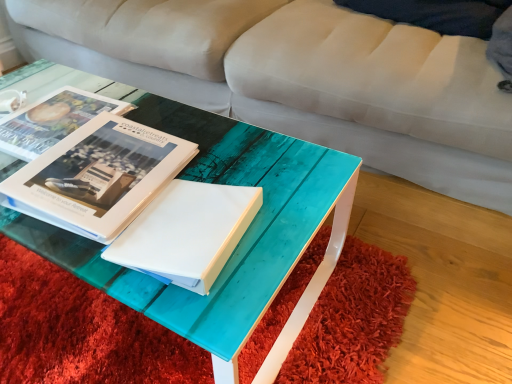
In order to face translucent teal table at center, should I rotate leftwards or rightwards?

It's best to rotate left around 11.096 degrees.

This screenshot has height=384, width=512. What do you see at coordinates (187, 233) in the screenshot?
I see `white matte paper at center` at bounding box center [187, 233].

Describe the element at coordinates (52, 120) in the screenshot. I see `matte white book at center, which appears as the 2th book when viewed from the front` at that location.

You are a GUI agent. You are given a task and a screenshot of the screen. Output one action in this format:
    pyautogui.click(x=<x>, y=<y>)
    Task: Click on the translucent teal table at center
    The height and width of the screenshot is (384, 512).
    Given the screenshot: What is the action you would take?
    pyautogui.click(x=81, y=331)

Can you confirm if white matte paper at center is positioned to the right of teal glossy wood coffee table at center?

Indeed, white matte paper at center is positioned on the right side of teal glossy wood coffee table at center.

Find the location of a particular element. This screenshot has height=384, width=512. coffee table on the left of white matte paper at center is located at coordinates (240, 240).

Who is bigger, white matte paper at center or teal glossy wood coffee table at center?

teal glossy wood coffee table at center is bigger.

Is white matte paper at center positioned beyond the bounds of teal glossy wood coffee table at center?

Yes, white matte paper at center is outside of teal glossy wood coffee table at center.

You are a GUI agent. You are given a task and a screenshot of the screen. Output one action in this format:
    pyautogui.click(x=<x>, y=<y>)
    Task: Click on the mat in front of the white matte paper at center
    
    Given the screenshot: What is the action you would take?
    pyautogui.click(x=81, y=331)

Can you confirm if translucent teal table at center is thinner than white matte paper at center?

Incorrect, the width of translucent teal table at center is not less than that of white matte paper at center.

How different are the orientations of translucent teal table at center and white matte paper at center in degrees?

They differ by 9.74 degrees in their facing directions.

How far apart are matte white book at center, which appears as the 2th book when viewed from the front, and white matte paper at center?

They are 15.70 inches apart.

Which is nearer, (50, 139) or (190, 244)?

Point (50, 139).

Can you confirm if matte white book at center, which appears as the 2th book when viewed from the front, is smaller than white matte paper at center?

Correct, matte white book at center, which appears as the 2th book when viewed from the front, occupies less space than white matte paper at center.

Looking at this image, considering the relative sizes of matte white book at center, marked as the first book in a front-to-back arrangement, and white matte paper at center in the image provided, is matte white book at center, marked as the first book in a front-to-back arrangement, smaller than white matte paper at center?

No, matte white book at center, marked as the first book in a front-to-back arrangement, is not smaller than white matte paper at center.

Is matte white book at center, marked as the first book in a front-to-back arrangement, inside the boundaries of white matte paper at center, or outside?

matte white book at center, marked as the first book in a front-to-back arrangement, exists outside the volume of white matte paper at center.

Does matte white book at center, marked as the first book in a front-to-back arrangement, come behind white matte paper at center?

Yes, matte white book at center, marked as the first book in a front-to-back arrangement, is behind white matte paper at center.

Is the surface of matte white book at center, marked as the first book in a front-to-back arrangement, in direct contact with white matte paper at center?

No, matte white book at center, marked as the first book in a front-to-back arrangement, is not next to white matte paper at center.

Between matte white book at center, which appears as the 2th book when viewed from the front, and translucent teal table at center, which one has larger size?

translucent teal table at center is bigger.

Is matte white book at center, which appears as the 2th book when viewed from the front, spatially inside translucent teal table at center, or outside of it?

matte white book at center, which appears as the 2th book when viewed from the front, lies outside translucent teal table at center.

Which object is positioned more to the right, teal glossy wood coffee table at center or matte white book at center, which appears as the 2th book when viewed from the front?

From the viewer's perspective, teal glossy wood coffee table at center appears more on the right side.

Which is more distant, (177, 305) or (59, 114)?

The point (59, 114) is farther from the camera.

Which of these two, teal glossy wood coffee table at center or matte white book at center, which appears as the 2th book when viewed from the front, stands shorter?

matte white book at center, which appears as the 2th book when viewed from the front.

Find the location of a particular element. The width and height of the screenshot is (512, 384). coffee table located on the right of matte white book at center, which appears as the 2th book when viewed from the front is located at coordinates (240, 240).

Between matte white book at center, marked as the first book in a front-to-back arrangement, and teal glossy wood coffee table at center, which one has larger width?

With larger width is teal glossy wood coffee table at center.

From the image's perspective, which object appears higher, matte white book at center, which appears as the second book when viewed from the back, or teal glossy wood coffee table at center?

teal glossy wood coffee table at center is shown above in the image.

At what (x,y) coordinates should I click in order to perform the action: click on paperback book on the right side of teal glossy wood coffee table at center. Please return your answer as a coordinate pair (x, y). The height and width of the screenshot is (384, 512). Looking at the image, I should click on (187, 233).

Locate an element on the screen. The height and width of the screenshot is (384, 512). mat located underneath the white matte paper at center (from a real-world perspective) is located at coordinates (81, 331).

Based on their spatial positions, is white matte paper at center or translucent teal table at center closer to teal glossy wood coffee table at center?

white matte paper at center lies closer to teal glossy wood coffee table at center than the other object.

Which object lies nearer to the anchor point translucent teal table at center, matte white book at center, the first book positioned from the back, or teal glossy wood coffee table at center?

teal glossy wood coffee table at center.

Which object lies further to the anchor point matte white book at center, which appears as the second book when viewed from the back, teal glossy wood coffee table at center or white matte paper at center?

Among the two, teal glossy wood coffee table at center is located further to matte white book at center, which appears as the second book when viewed from the back.

From the image, which object appears to be nearer to matte white book at center, which appears as the second book when viewed from the back, teal glossy wood coffee table at center or matte white book at center, the first book positioned from the back?

The object closer to matte white book at center, which appears as the second book when viewed from the back, is teal glossy wood coffee table at center.

Estimate the real-world distances between objects in this image. Which object is closer to matte white book at center, which appears as the second book when viewed from the back, translucent teal table at center or matte white book at center, the first book positioned from the back?

matte white book at center, the first book positioned from the back, is positioned closer to the anchor matte white book at center, which appears as the second book when viewed from the back.

Based on their spatial positions, is translucent teal table at center or teal glossy wood coffee table at center closer to matte white book at center, the first book positioned from the back?

teal glossy wood coffee table at center.

Consider the image. Considering their positions, is white matte paper at center positioned further to teal glossy wood coffee table at center than matte white book at center, the first book positioned from the back?

matte white book at center, the first book positioned from the back, lies further to teal glossy wood coffee table at center than the other object.

Looking at the image, which one is located further to matte white book at center, marked as the first book in a front-to-back arrangement, white matte paper at center or matte white book at center, which appears as the 2th book when viewed from the front?

The object further to matte white book at center, marked as the first book in a front-to-back arrangement, is matte white book at center, which appears as the 2th book when viewed from the front.

Find the location of `book located between teal glossy wood coffee table at center and matte white book at center, which appears as the 2th book when viewed from the front, in the depth direction`. book located between teal glossy wood coffee table at center and matte white book at center, which appears as the 2th book when viewed from the front, in the depth direction is located at coordinates (98, 176).

Find the location of a particular element. This screenshot has height=384, width=512. paperback book between matte white book at center, which appears as the second book when viewed from the back, and translucent teal table at center, in the vertical direction is located at coordinates (187, 233).

The image size is (512, 384). Identify the location of paperback book between matte white book at center, the first book positioned from the back, and translucent teal table at center in the up-down direction. (187, 233).

I want to click on book between teal glossy wood coffee table at center and translucent teal table at center from top to bottom, so click(x=98, y=176).